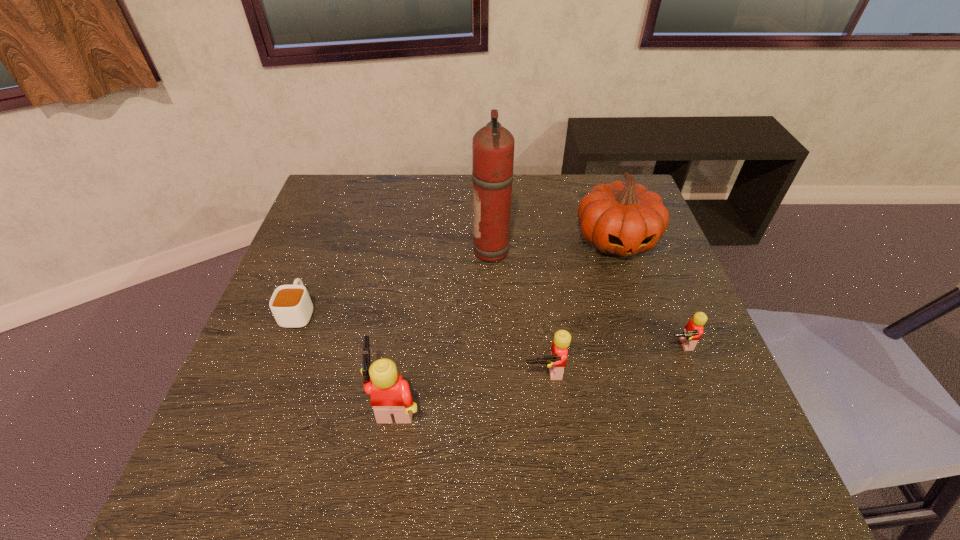
Please point a vacant point for placing a Lego on the left. Please provide its 2D coordinates. Your answer should be formatted as a tuple, i.e. [(x, y)], where the tuple contains the x and y coordinates of a point satisfying the conditions above.

[(229, 434)]